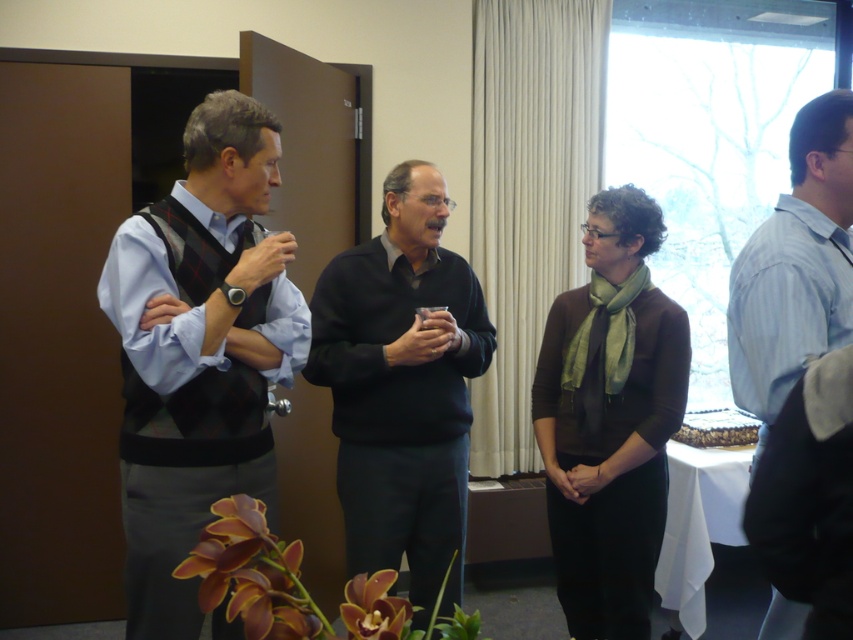
Can you confirm if dark gray sweater at center is positioned to the left of light blue shirt at right?

Indeed, dark gray sweater at center is positioned on the left side of light blue shirt at right.

Can you confirm if dark gray sweater at center is positioned above light blue shirt at right?

Actually, dark gray sweater at center is below light blue shirt at right.

Is point (363, 422) farther from camera compared to point (775, 609)?

Yes, it is.

Identify the location of dark gray sweater at center. The width and height of the screenshot is (853, 640). (402, 387).

From the picture: Who is lower down, matte black vest at left or light blue shirt at right?

matte black vest at left is below.

Describe the element at coordinates (199, 352) in the screenshot. The width and height of the screenshot is (853, 640). I see `matte black vest at left` at that location.

The image size is (853, 640). I want to click on matte black vest at left, so [x=199, y=352].

Does matte black vest at left have a lesser width compared to dark gray sweater at center?

Correct, matte black vest at left's width is less than dark gray sweater at center's.

Who is positioned more to the left, matte black vest at left or dark gray sweater at center?

matte black vest at left is more to the left.

Find the location of a particular element. This screenshot has height=640, width=853. matte black vest at left is located at coordinates (199, 352).